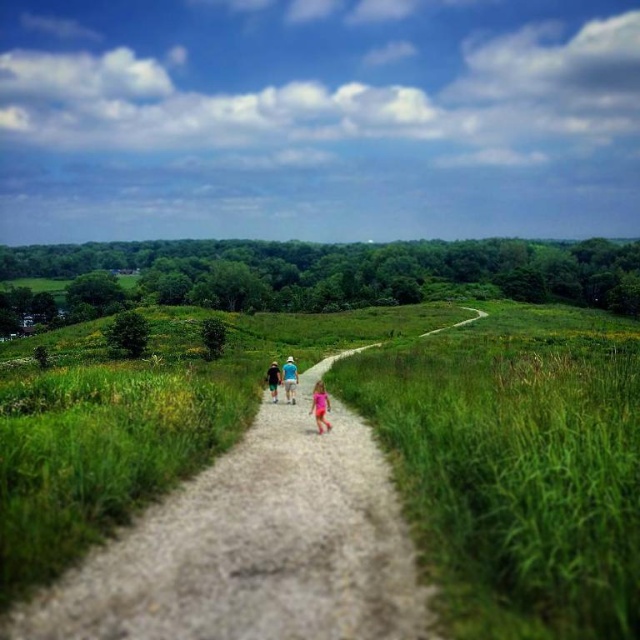
Question: Can you confirm if blue cotton shirt at center is bigger than pink fabric at center?

Choices:
 (A) no
 (B) yes

Answer: (B)

Question: Is blue cotton shirt at center to the left of blue denim shorts at center from the viewer's perspective?

Choices:
 (A) yes
 (B) no

Answer: (B)

Question: Which object appears farthest from the camera in this image?

Choices:
 (A) pink fabric at center
 (B) green grassy at center
 (C) blue fabric shirt at center

Answer: (C)

Question: Where is dirt path at center located in relation to blue fabric shirt at center in the image?

Choices:
 (A) right
 (B) left

Answer: (A)

Question: Which object appears farthest from the camera in this image?

Choices:
 (A) blue cotton shirt at center
 (B) pink fabric at center
 (C) dirt path at center

Answer: (A)

Question: Which point is closer to the camera?

Choices:
 (A) (296, 371)
 (B) (292, 364)
 (C) (499, 557)

Answer: (C)